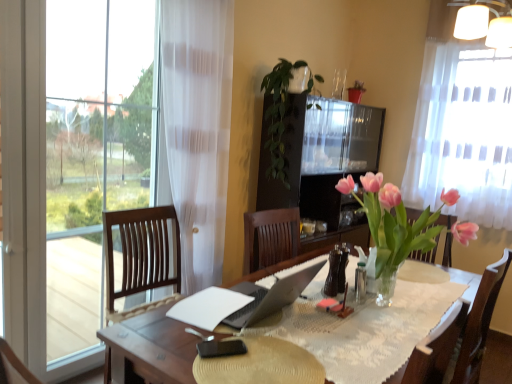
Question: Looking at their shapes, would you say white matte lampshade at upper right is wider or thinner than white paper at center?

Choices:
 (A) thin
 (B) wide

Answer: (A)

Question: Is point (458, 21) positioned closer to the camera than point (180, 317)?

Choices:
 (A) closer
 (B) farther

Answer: (B)

Question: Which object is the farthest from the black matte phone at center?

Choices:
 (A) white matte lampshade at upper right
 (B) brown leather bottle at center
 (C) white paper at center
 (D) white sheer curtain at upper right
 (E) green leafy plant at center

Answer: (D)

Question: Which of these objects is positioned closest to the white sheer curtain at upper right?

Choices:
 (A) white paper at center
 (B) white matte lampshade at upper right
 (C) green leafy plant at center
 (D) brown leather bottle at center
 (E) black matte phone at center

Answer: (B)